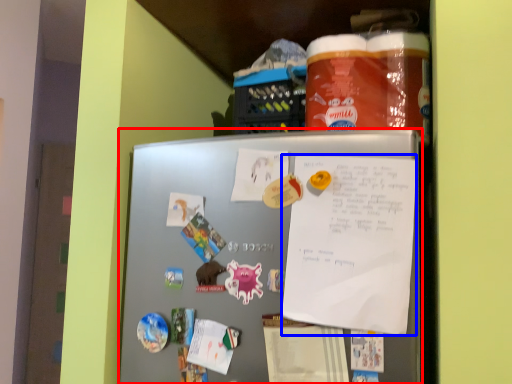
Question: Which of the following is the farthest to the observer, refrigerator (highlighted by a red box) or poster (highlighted by a blue box)?

Choices:
 (A) refrigerator
 (B) poster

Answer: (B)